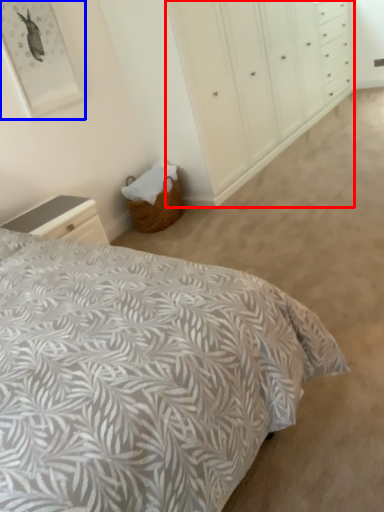
Question: Which object appears farthest to the camera in this image, dresser (highlighted by a red box) or picture frame (highlighted by a blue box)?

Choices:
 (A) dresser
 (B) picture frame

Answer: (A)